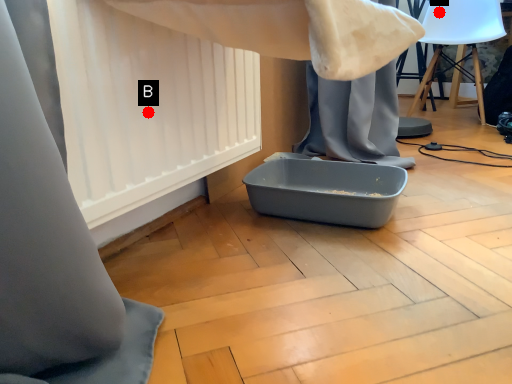
Question: Two points are circled on the image, labeled by A and B beside each circle. Among these points, which one is nearest to the camera?

Choices:
 (A) A is closer
 (B) B is closer

Answer: (B)